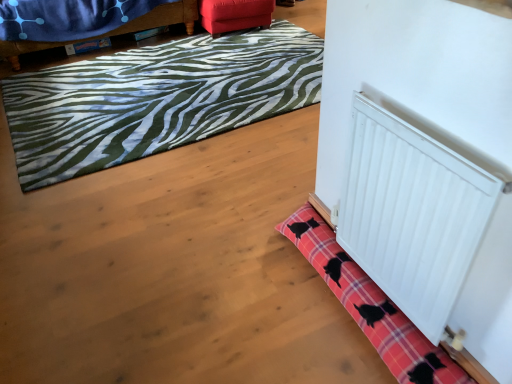
Question: Considering the relative sizes of green zebra-patterned rug at upper left, the 1th bath mat from the top, and velvet blue blanket at upper left, positioned as the 1th furniture in left-to-right order, in the image provided, is green zebra-patterned rug at upper left, the 1th bath mat from the top, shorter than velvet blue blanket at upper left, positioned as the 1th furniture in left-to-right order,?

Choices:
 (A) no
 (B) yes

Answer: (B)

Question: Is velvet blue blanket at upper left, which is the 2th furniture in right-to-left order, surrounded by green zebra-patterned rug at upper left, the 1th bath mat in the back-to-front sequence?

Choices:
 (A) yes
 (B) no

Answer: (B)

Question: From a real-world perspective, is green zebra-patterned rug at upper left, the 1th bath mat in the back-to-front sequence, physically below velvet blue blanket at upper left, positioned as the 1th furniture in left-to-right order?

Choices:
 (A) no
 (B) yes

Answer: (B)

Question: Is green zebra-patterned rug at upper left, the 2th bath mat in the bottom-to-top sequence, in front of velvet blue blanket at upper left, positioned as the 1th furniture in left-to-right order?

Choices:
 (A) no
 (B) yes

Answer: (B)

Question: Is velvet blue blanket at upper left, which is the 2th furniture in right-to-left order, at the back of green zebra-patterned rug at upper left, the 1th bath mat in the back-to-front sequence?

Choices:
 (A) no
 (B) yes

Answer: (A)

Question: Is green zebra-patterned rug at upper left, the 2th bath mat in the bottom-to-top sequence, located outside velvet blue blanket at upper left, positioned as the 1th furniture in left-to-right order?

Choices:
 (A) yes
 (B) no

Answer: (A)

Question: Is green zebra-patterned rug at upper left, the 1th bath mat in the back-to-front sequence, further to camera compared to pink plaid bath mat at lower right, marked as the 2th bath mat in a top-to-bottom arrangement?

Choices:
 (A) no
 (B) yes

Answer: (B)

Question: Is green zebra-patterned rug at upper left, acting as the 2th bath mat starting from the front, at the left side of pink plaid bath mat at lower right, placed as the 1th bath mat when sorted from front to back?

Choices:
 (A) yes
 (B) no

Answer: (A)

Question: Is green zebra-patterned rug at upper left, the 2th bath mat in the bottom-to-top sequence, aimed at pink plaid bath mat at lower right, acting as the first bath mat starting from the bottom?

Choices:
 (A) yes
 (B) no

Answer: (A)

Question: Considering the relative sizes of green zebra-patterned rug at upper left, the 1th bath mat in the back-to-front sequence, and pink plaid bath mat at lower right, marked as the 2th bath mat in a top-to-bottom arrangement, in the image provided, is green zebra-patterned rug at upper left, the 1th bath mat in the back-to-front sequence, bigger than pink plaid bath mat at lower right, marked as the 2th bath mat in a top-to-bottom arrangement,?

Choices:
 (A) yes
 (B) no

Answer: (A)

Question: Is green zebra-patterned rug at upper left, acting as the 2th bath mat starting from the front, smaller than pink plaid bath mat at lower right, placed as the 1th bath mat when sorted from front to back?

Choices:
 (A) no
 (B) yes

Answer: (A)

Question: Is green zebra-patterned rug at upper left, acting as the 2th bath mat starting from the front, shorter than pink plaid bath mat at lower right, the 2th bath mat in the back-to-front sequence?

Choices:
 (A) yes
 (B) no

Answer: (A)

Question: From a real-world perspective, does velvet red ottoman at upper center, the second furniture viewed from the left, stand above green zebra-patterned rug at upper left, acting as the 2th bath mat starting from the front?

Choices:
 (A) yes
 (B) no

Answer: (A)